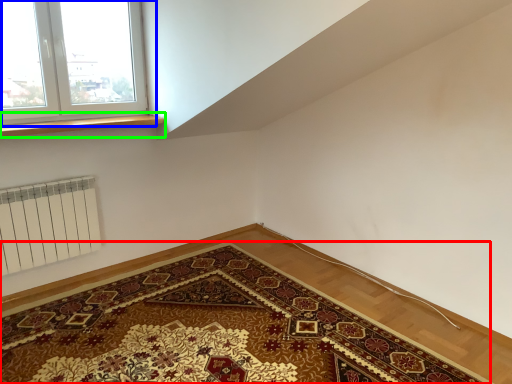
Question: Which object is the farthest from mat (highlighted by a red box)? Choose among these: window (highlighted by a blue box) or window sill (highlighted by a green box).

Choices:
 (A) window
 (B) window sill

Answer: (A)